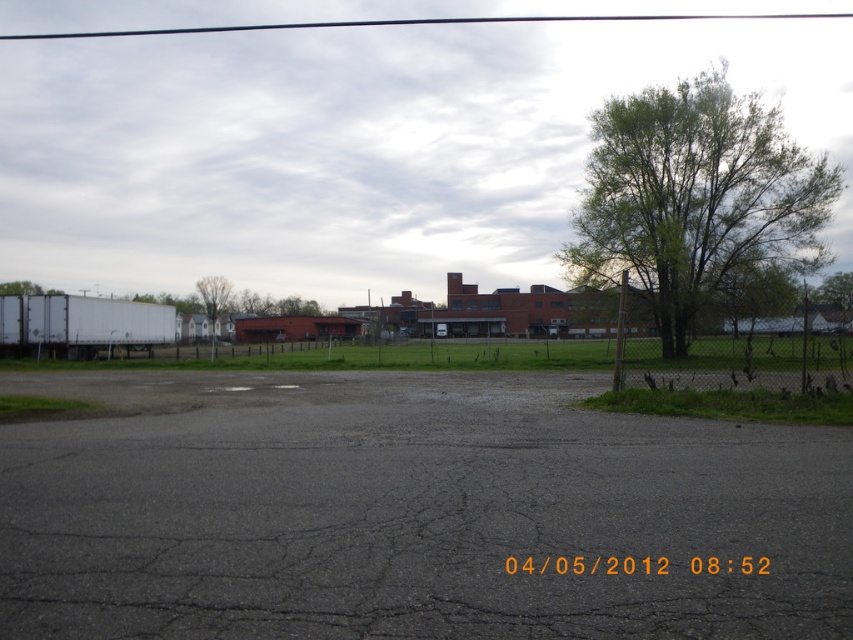
Question: Considering the relative positions of green leafy tree at right and metal chain-link fence at right in the image provided, where is green leafy tree at right located with respect to metal chain-link fence at right?

Choices:
 (A) below
 (B) above

Answer: (B)

Question: Which point is farther to the camera?

Choices:
 (A) (724, 321)
 (B) (747, 154)

Answer: (B)

Question: Among these points, which one is farthest from the camera?

Choices:
 (A) (224, 284)
 (B) (769, 205)
 (C) (775, 380)

Answer: (A)

Question: Is green leafy tree at right below metal chain-link fence at right?

Choices:
 (A) yes
 (B) no

Answer: (B)

Question: In this image, where is metal chain-link fence at right located relative to green leafy tree at center?

Choices:
 (A) left
 (B) right

Answer: (B)

Question: Among these points, which one is farthest from the camera?

Choices:
 (A) (642, 124)
 (B) (196, 291)

Answer: (B)